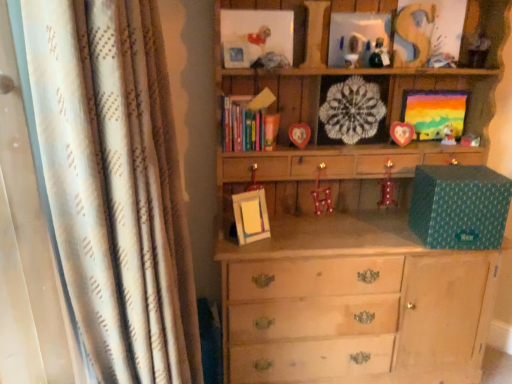
Image resolution: width=512 pixels, height=384 pixels. What do you see at coordinates (352, 110) in the screenshot? I see `white lace doily at upper center, the fourth picture frame positioned from the right` at bounding box center [352, 110].

At what (x,y) coordinates should I click in order to perform the action: click on hardcover books at center. Please return your answer as a coordinate pair (x, y). Looking at the image, I should click on (244, 121).

I want to click on matte plastic toy at upper center, which is the fifth toy from right to left, so click(353, 50).

Describe the element at coordinates (115, 185) in the screenshot. I see `beige textured curtain at left` at that location.

Describe the element at coordinates (251, 216) in the screenshot. I see `yellow matte picture frame at center, which is the 2th picture frame in left-to-right order` at that location.

Locate an element on the screen. This screenshot has width=512, height=384. white lace doily at upper center, the fourth picture frame positioned from the right is located at coordinates (352, 110).

Considering the relative sizes of matte white figurine at upper right, acting as the 2th toy starting from the bottom, and beige textured curtain at left in the image provided, is matte white figurine at upper right, acting as the 2th toy starting from the bottom, taller than beige textured curtain at left?

No.

Between matte white figurine at upper right, which is counted as the 3th toy, starting from the left, and beige textured curtain at left, which one appears on the right side from the viewer's perspective?

matte white figurine at upper right, which is counted as the 3th toy, starting from the left.

Looking at their sizes, would you say matte white figurine at upper right, which is the fourth toy from top to bottom, is wider or thinner than beige textured curtain at left?

Considering their sizes, matte white figurine at upper right, which is the fourth toy from top to bottom, looks slimmer than beige textured curtain at left.

Would you say matte white figurine at upper right, which is the 3th toy from right to left, is outside beige textured curtain at left?

Indeed, matte white figurine at upper right, which is the 3th toy from right to left, is completely outside beige textured curtain at left.

Image resolution: width=512 pixels, height=384 pixels. I want to click on the 2nd picture frame directly above the wooden toy at upper right, arranged as the second toy when viewed from the right (from a real-world perspective), so click(x=255, y=35).

Considering the relative sizes of matte plastic picture frame at upper center, the 3th picture frame positioned from the left, and wooden toy at upper right, which is the 4th toy in left-to-right order, in the image provided, is matte plastic picture frame at upper center, the 3th picture frame positioned from the left, wider than wooden toy at upper right, which is the 4th toy in left-to-right order,?

No.

Who is shorter, matte plastic picture frame at upper center, the 3th picture frame positioned from the left, or wooden toy at upper right, which is counted as the first toy, starting from the top?

wooden toy at upper right, which is counted as the first toy, starting from the top, is shorter.

How different are the orientations of matte plastic picture frame at upper center, the 3th picture frame positioned from the left, and wooden toy at upper right, arranged as the second toy when viewed from the right, in degrees?

6.88 degrees separate the facing orientations of matte plastic picture frame at upper center, the 3th picture frame positioned from the left, and wooden toy at upper right, arranged as the second toy when viewed from the right.

Consider the image. Is metallic red ornament at center, which appears as the second miniature when viewed from the right, bigger than matte plastic picture frame at upper center, the 3th picture frame positioned from the left?

No, metallic red ornament at center, which appears as the second miniature when viewed from the right, is not bigger than matte plastic picture frame at upper center, the 3th picture frame positioned from the left.

Considering the sizes of metallic red ornament at center, which is the first miniature in left-to-right order, and matte plastic picture frame at upper center, the 3th picture frame positioned from the left, in the image, is metallic red ornament at center, which is the first miniature in left-to-right order, taller or shorter than matte plastic picture frame at upper center, the 3th picture frame positioned from the left,?

In the image, metallic red ornament at center, which is the first miniature in left-to-right order, appears to be taller than matte plastic picture frame at upper center, the 3th picture frame positioned from the left.

What's the angular difference between metallic red ornament at center, which is the first miniature in left-to-right order, and matte plastic picture frame at upper center, the 3th picture frame positioned from the left,'s facing directions?

The angular difference between metallic red ornament at center, which is the first miniature in left-to-right order, and matte plastic picture frame at upper center, the 3th picture frame positioned from the left, is 7.35 degrees.

Is metallic red ornament at center, which is the first miniature in left-to-right order, facing towards matte plastic picture frame at upper center, the 3th picture frame positioned from the left?

No, metallic red ornament at center, which is the first miniature in left-to-right order, is not facing towards matte plastic picture frame at upper center, the 3th picture frame positioned from the left.

From the image's perspective, which one is positioned higher, metallic red candlestick at center-right, the first miniature positioned from the right, or matte wooden picture frame at upper center, which appears as the sixth picture frame when viewed from the left?

From the image's view, matte wooden picture frame at upper center, which appears as the sixth picture frame when viewed from the left, is above.

Can you confirm if metallic red candlestick at center-right, the first miniature positioned from the right, is bigger than matte wooden picture frame at upper center, placed as the 3th picture frame when sorted from right to left?

No, metallic red candlestick at center-right, the first miniature positioned from the right, is not bigger than matte wooden picture frame at upper center, placed as the 3th picture frame when sorted from right to left.

In the scene shown: Is metallic red candlestick at center-right, the 2th miniature when ordered from left to right, wider or thinner than matte wooden picture frame at upper center, placed as the 3th picture frame when sorted from right to left?

In the image, metallic red candlestick at center-right, the 2th miniature when ordered from left to right, appears to be more narrow than matte wooden picture frame at upper center, placed as the 3th picture frame when sorted from right to left.

Is wooden heart-shaped frame at center, marked as the 5th picture frame in a right-to-left arrangement, bigger or smaller than matte plastic toy at center, the 1th toy from the bottom?

wooden heart-shaped frame at center, marked as the 5th picture frame in a right-to-left arrangement, is bigger than matte plastic toy at center, the 1th toy from the bottom.

Is wooden heart-shaped frame at center, which appears as the 4th picture frame when viewed from the left, closer to camera compared to matte plastic toy at center, arranged as the 5th toy when viewed from the left?

Yes, it is.

The width and height of the screenshot is (512, 384). Identify the location of the 2nd picture frame in front of the matte plastic toy at center, arranged as the 5th toy when viewed from the left. (298, 134).

From a real-world perspective, between glossy plastic toy at upper center, which is counted as the 4th toy, starting from the right, and metallic red ornament at center, which is the first miniature in left-to-right order, who is vertically lower?

metallic red ornament at center, which is the first miniature in left-to-right order, is physically lower.

Identify the location of the 2nd toy in front of the metallic red ornament at center, which appears as the second miniature when viewed from the right. (379, 55).

Is glossy plastic toy at upper center, which ranks as the second toy in left-to-right order, located outside metallic red ornament at center, which is the first miniature in left-to-right order?

That's correct, glossy plastic toy at upper center, which ranks as the second toy in left-to-right order, is outside of metallic red ornament at center, which is the first miniature in left-to-right order.

Between glossy plastic toy at upper center, which is counted as the 4th toy, starting from the right, and metallic red ornament at center, which appears as the second miniature when viewed from the right, which one has larger size?

metallic red ornament at center, which appears as the second miniature when viewed from the right, is bigger.

Is light wood chest of drawers at center not inside matte canvas painting at upper right, which appears as the 8th picture frame when viewed from the left?

Yes, light wood chest of drawers at center is located beyond the bounds of matte canvas painting at upper right, which appears as the 8th picture frame when viewed from the left.

In the scene shown: Is light wood chest of drawers at center wider than matte canvas painting at upper right, which appears as the 8th picture frame when viewed from the left?

Yes, light wood chest of drawers at center is wider than matte canvas painting at upper right, which appears as the 8th picture frame when viewed from the left.

Where is `chest of drawers that is on the left side of matte canvas painting at upper right, the 1th picture frame positioned from the right`? The width and height of the screenshot is (512, 384). chest of drawers that is on the left side of matte canvas painting at upper right, the 1th picture frame positioned from the right is located at coordinates (347, 276).

This screenshot has width=512, height=384. Find the location of `curtain in front of the matte white figurine at upper right, which is the 3th toy from right to left`. curtain in front of the matte white figurine at upper right, which is the 3th toy from right to left is located at coordinates pyautogui.click(x=115, y=185).

Where is `the 6th picture frame counting from the left of the wooden toy at upper right, which is the 4th toy in left-to-right order`? the 6th picture frame counting from the left of the wooden toy at upper right, which is the 4th toy in left-to-right order is located at coordinates (255, 35).

Estimate the real-world distances between objects in this image. Which object is further from wooden toy at upper right, which is the 4th toy in left-to-right order, matte wooden picture frame at upper center, placed as the 3th picture frame when sorted from right to left, or metallic red ornament at center, which appears as the second miniature when viewed from the right?

Based on the image, metallic red ornament at center, which appears as the second miniature when viewed from the right, appears to be further to wooden toy at upper right, which is the 4th toy in left-to-right order.

Considering their positions, is white lace doily at upper center, the fourth picture frame positioned from the right, positioned closer to metallic silver picture frame at upper center, which appears as the eighth picture frame when viewed from the right, than matte canvas painting at upper right, which appears as the 8th picture frame when viewed from the left?

white lace doily at upper center, the fourth picture frame positioned from the right.

Which object lies further to the anchor point wooden heart-shaped frame at center, the seventh picture frame when ordered from left to right, beige textured curtain at left or hardcover books at center?

beige textured curtain at left is further to wooden heart-shaped frame at center, the seventh picture frame when ordered from left to right.

In the scene shown: When comparing their distances from yellow matte picture frame at center, which is the 2th picture frame in left-to-right order, does teal matte gift box at right or matte canvas painting at upper right, the 1th picture frame positioned from the right, seem further?

matte canvas painting at upper right, the 1th picture frame positioned from the right, is positioned further to the anchor yellow matte picture frame at center, which is the 2th picture frame in left-to-right order.

Based on their spatial positions, is metallic silver picture frame at upper center, the first picture frame from the left, or white lace doily at upper center, the 5th picture frame positioned from the left, further from matte canvas painting at upper right, the 1th picture frame positioned from the right?

metallic silver picture frame at upper center, the first picture frame from the left, lies further to matte canvas painting at upper right, the 1th picture frame positioned from the right, than the other object.

Which object lies further to the anchor point matte plastic picture frame at upper center, which is the 6th picture frame in right-to-left order, metallic silver picture frame at upper center, the first picture frame from the left, or matte plastic toy at center, arranged as the 5th toy when viewed from the left?

matte plastic toy at center, arranged as the 5th toy when viewed from the left, is positioned further to the anchor matte plastic picture frame at upper center, which is the 6th picture frame in right-to-left order.

Looking at the image, which one is located closer to glossy plastic toy at upper center, which ranks as the second toy in left-to-right order, metallic red candlestick at center-right, the first miniature positioned from the right, or white lace doily at upper center, the fourth picture frame positioned from the right?

Among the two, white lace doily at upper center, the fourth picture frame positioned from the right, is located nearer to glossy plastic toy at upper center, which ranks as the second toy in left-to-right order.

Looking at the image, which one is located further to wooden toy at upper right, which is counted as the first toy, starting from the top, yellow matte picture frame at center, which is the 2th picture frame in left-to-right order, or metallic red ornament at center, which appears as the second miniature when viewed from the right?

Based on the image, yellow matte picture frame at center, which is the 2th picture frame in left-to-right order, appears to be further to wooden toy at upper right, which is counted as the first toy, starting from the top.

Where is `the chest of drawers located between yellow matte picture frame at center, which is the 2th picture frame in left-to-right order, and metallic red candlestick at center-right, the 2th miniature when ordered from left to right, in the left-right direction`? This screenshot has width=512, height=384. the chest of drawers located between yellow matte picture frame at center, which is the 2th picture frame in left-to-right order, and metallic red candlestick at center-right, the 2th miniature when ordered from left to right, in the left-right direction is located at coordinates (347, 276).

Identify the location of storage box situated between yellow matte picture frame at center, which is the 2th picture frame in left-to-right order, and wooden toy at upper right, which is the 4th toy in left-to-right order, from left to right. (459, 207).

Find the location of `toy located between matte wooden picture frame at upper center, which appears as the sixth picture frame when viewed from the left, and matte canvas painting at upper right, which appears as the 8th picture frame when viewed from the left, in the left-right direction`. toy located between matte wooden picture frame at upper center, which appears as the sixth picture frame when viewed from the left, and matte canvas painting at upper right, which appears as the 8th picture frame when viewed from the left, in the left-right direction is located at coordinates (379, 55).

The height and width of the screenshot is (384, 512). In order to click on storage box located between wooden heart-shaped frame at center, which appears as the 4th picture frame when viewed from the left, and matte white figurine at upper right, which is the 3th toy from right to left, in the left-right direction in this screenshot , I will do `click(459, 207)`.